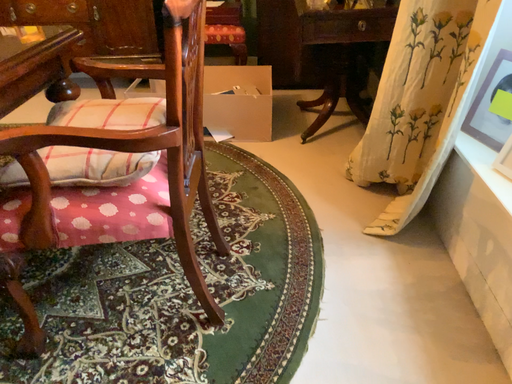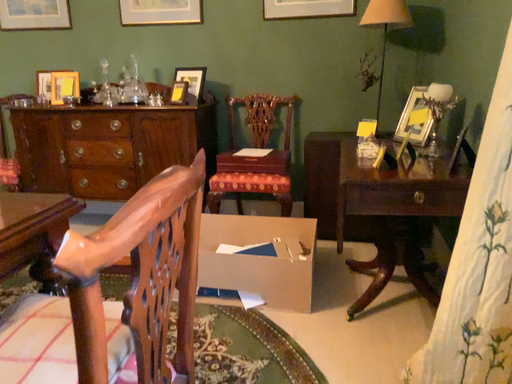
Question: How did the camera likely rotate when shooting the video?

Choices:
 (A) rotated right
 (B) rotated left

Answer: (B)